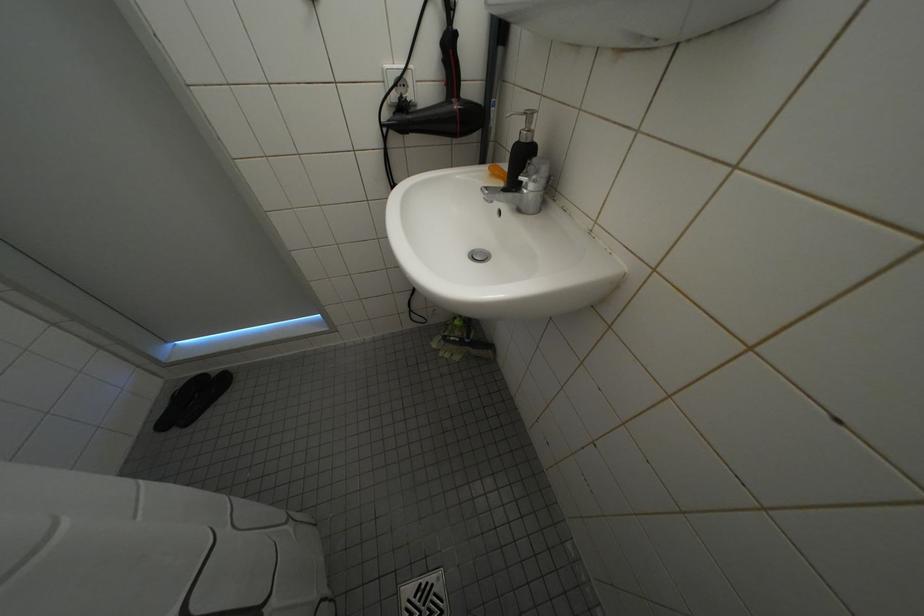
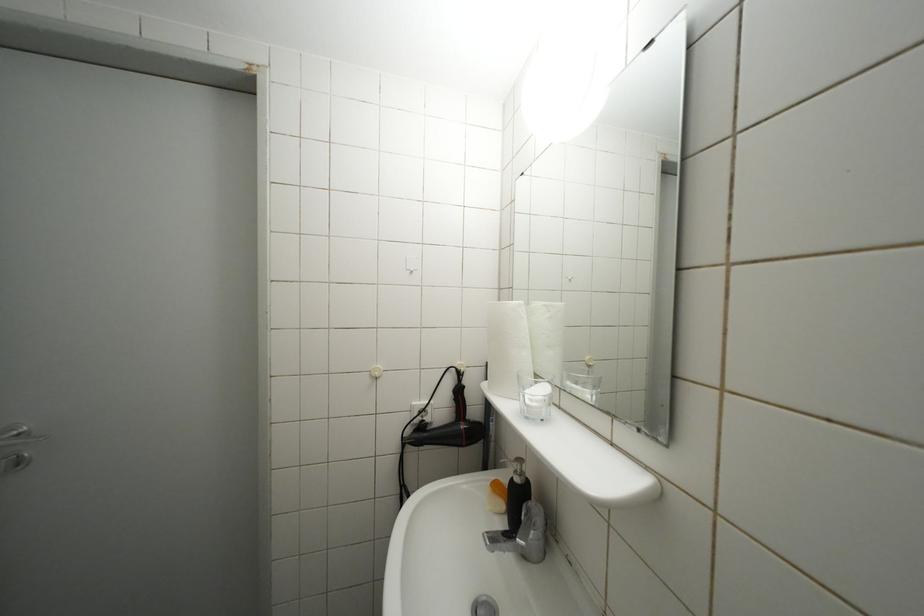
Question: How did the camera likely rotate?

Choices:
 (A) Left
 (B) Right
 (C) Up
 (D) Down

Answer: (C)